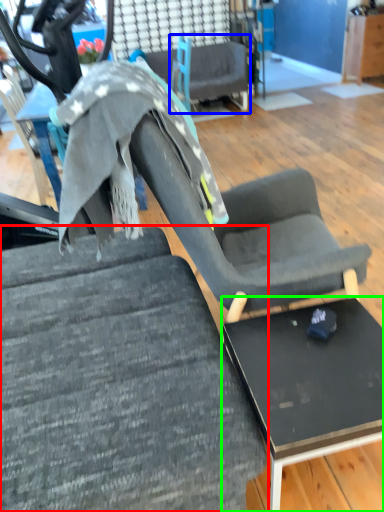
Question: Considering the real-world distances, which object is farthest from chair (highlighted by a red box)? chair (highlighted by a blue box) or table (highlighted by a green box)?

Choices:
 (A) chair
 (B) table

Answer: (A)